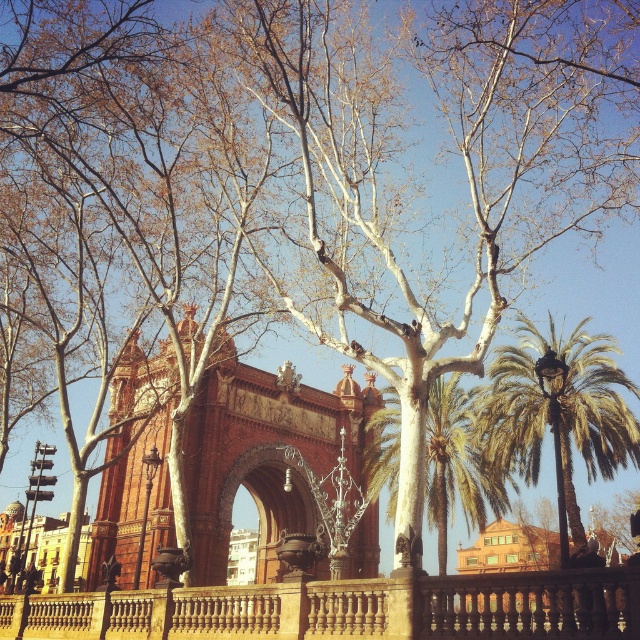
Is green leafy palm tree at right in front of green leafy palm tree at center?

Yes, green leafy palm tree at right is closer to the viewer.

Is point (570, 493) in front of point (371, 481)?

Yes, point (570, 493) is closer to viewer.

This screenshot has width=640, height=640. What do you see at coordinates (557, 413) in the screenshot? I see `green leafy palm tree at right` at bounding box center [557, 413].

Find the location of a particular element. The height and width of the screenshot is (640, 640). green leafy palm tree at right is located at coordinates (557, 413).

Does green leafy palm tree at right come in front of polished bronze archway at center?

Yes.

Between green leafy palm tree at right and polished bronze archway at center, which one is positioned higher?

Positioned higher is green leafy palm tree at right.

Is point (528, 449) farther from viewer compared to point (308, 532)?

No, (528, 449) is in front of (308, 532).

Identify the location of green leafy palm tree at right. (557, 413).

Is point (433, 413) positioned after point (310, 531)?

That is False.

Can you confirm if green leafy palm tree at center is positioned to the left of polished bronze archway at center?

Incorrect, green leafy palm tree at center is not on the left side of polished bronze archway at center.

I want to click on green leafy palm tree at center, so click(x=456, y=464).